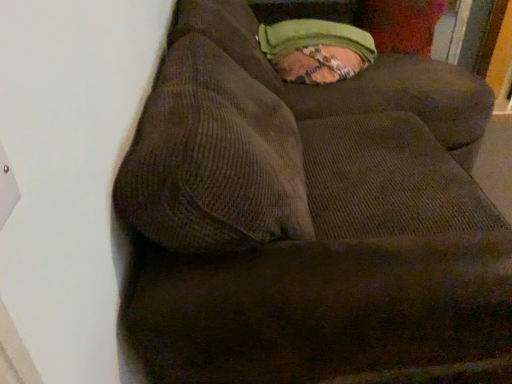
Question: Should I look upward or downward to see green corduroy pillow at upper right?

Choices:
 (A) down
 (B) up

Answer: (B)